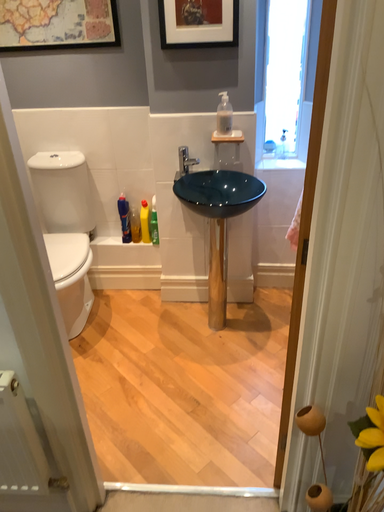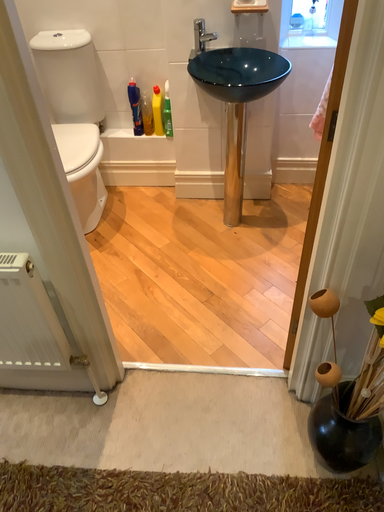
Question: Which way did the camera rotate in the video?

Choices:
 (A) rotated downward
 (B) rotated upward

Answer: (A)